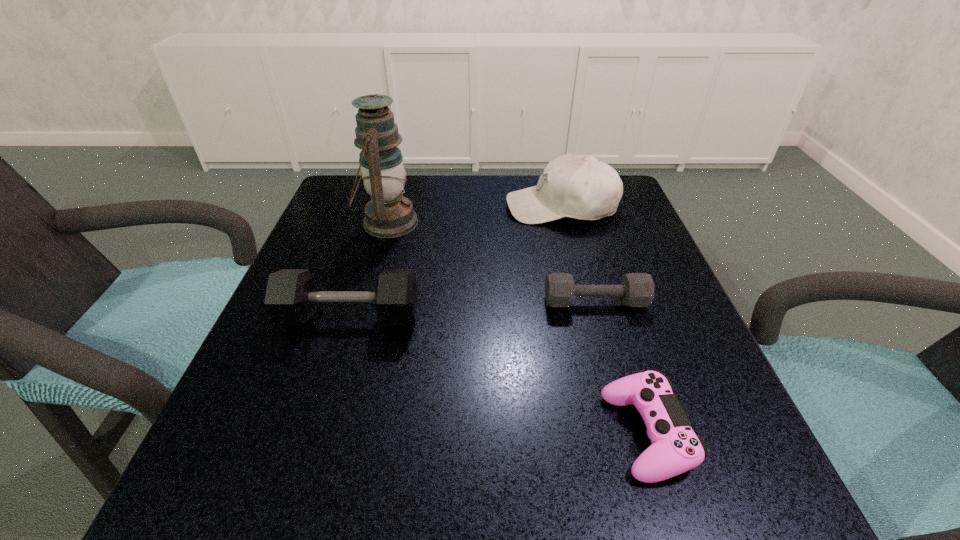
At what (x,y) coordinates should I click in order to perform the action: click on oil lamp. Please return your answer as a coordinate pair (x, y). Looking at the image, I should click on (389, 214).

Image resolution: width=960 pixels, height=540 pixels. I want to click on baseball cap, so click(x=581, y=187).

Locate an element on the screen. the third tallest object is located at coordinates (290, 298).

Where is `the taller dumbbell`? The image size is (960, 540). the taller dumbbell is located at coordinates (290, 298).

This screenshot has height=540, width=960. Find the location of `the right dumbbell`. the right dumbbell is located at coordinates (636, 289).

Identify the location of the nearest object. (675, 449).

What are the coordinates of `vacant region located on the back of the oil lamp` in the screenshot? It's located at (400, 179).

You are a GUI agent. You are given a task and a screenshot of the screen. Output one action in this format:
    pyautogui.click(x=<x>, y=<y>)
    Task: Click on the blank space located 0.200m on the front-facing side of the baseball cap
    The image size is (960, 540).
    Given the screenshot: What is the action you would take?
    pyautogui.click(x=422, y=207)

Locate an element on the screen. free spot located 0.300m on the front-facing side of the baseball cap is located at coordinates (380, 207).

This screenshot has height=540, width=960. Identify the location of vacant space positioned 0.200m on the front-facing side of the baseball cap. (422, 207).